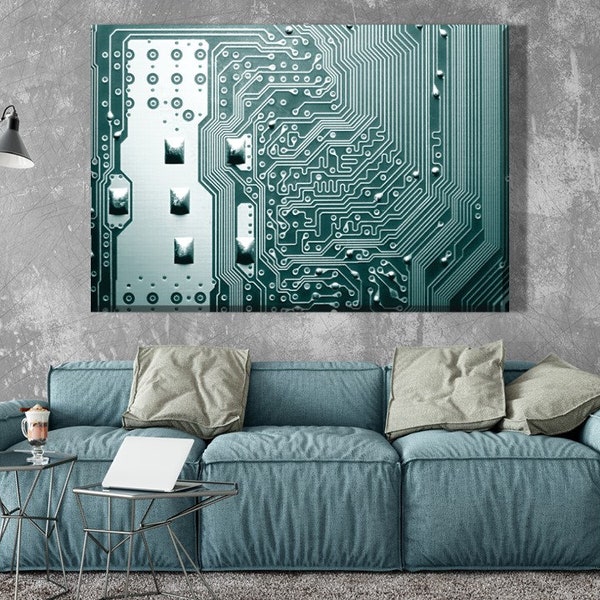
The image size is (600, 600). I want to click on artwork, so click(300, 211).